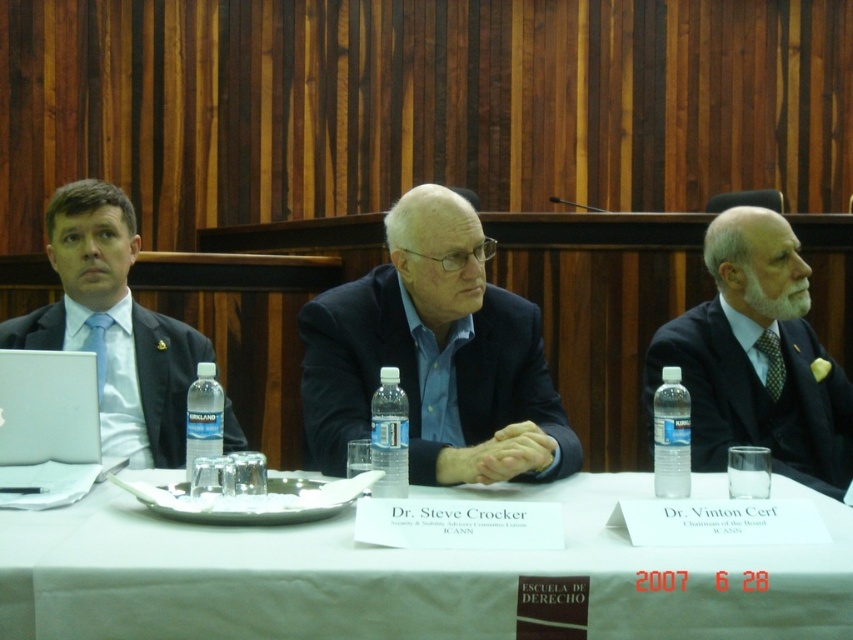
You are a photographer positioned behind the table and want to capture a closeup of the silver metallic laptop at left and the green textured tie at right. Which object should you focus on first to ensure it appears sharp in the photo?

You should focus on the silver metallic laptop at left first because it is closer to the viewer than the green textured tie at right, so adjusting focus starting from the closer object ensures both are in sharp focus.

You are a photographer standing in front of the table. You need to place a 1.5 meter long banner between the clear plastic bottle at right and the edge of the table closest to you. Is there enough space for the banner?

The clear plastic bottle at right is 1.62 meters from the viewer. Since the banner is 1.5 meters long, there is enough space between the bottle and the table edge to place it.